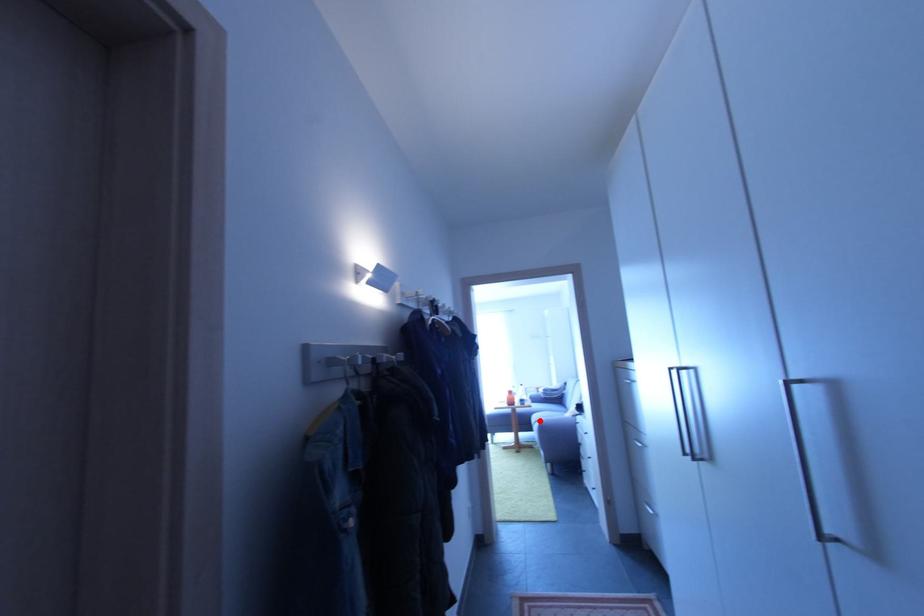
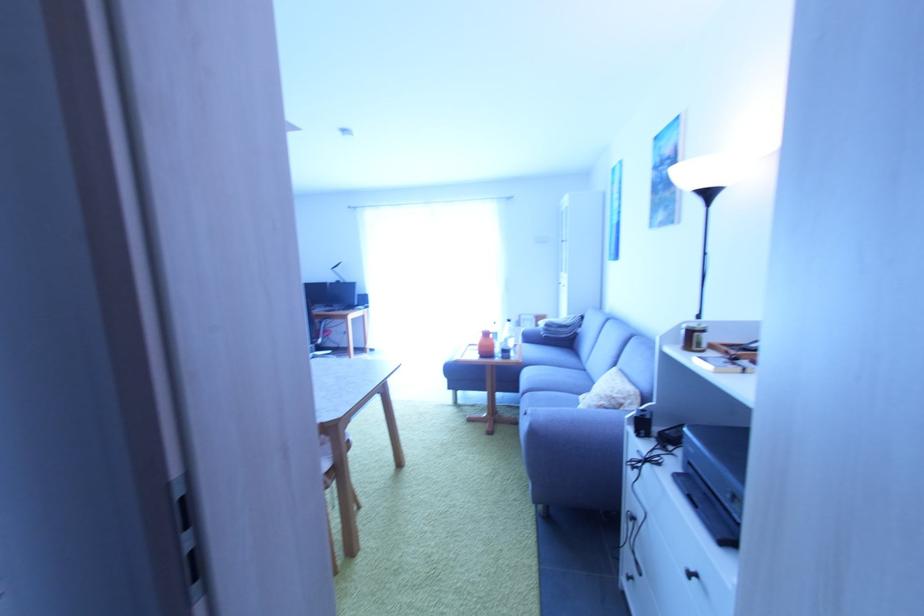
Question: I am providing you with two images of the same scene from different viewpoints. A red point is shown in image1. For the corresponding object point in image2, is it positioned nearer or farther from the camera?

Choices:
 (A) Nearer
 (B) Farther

Answer: (A)